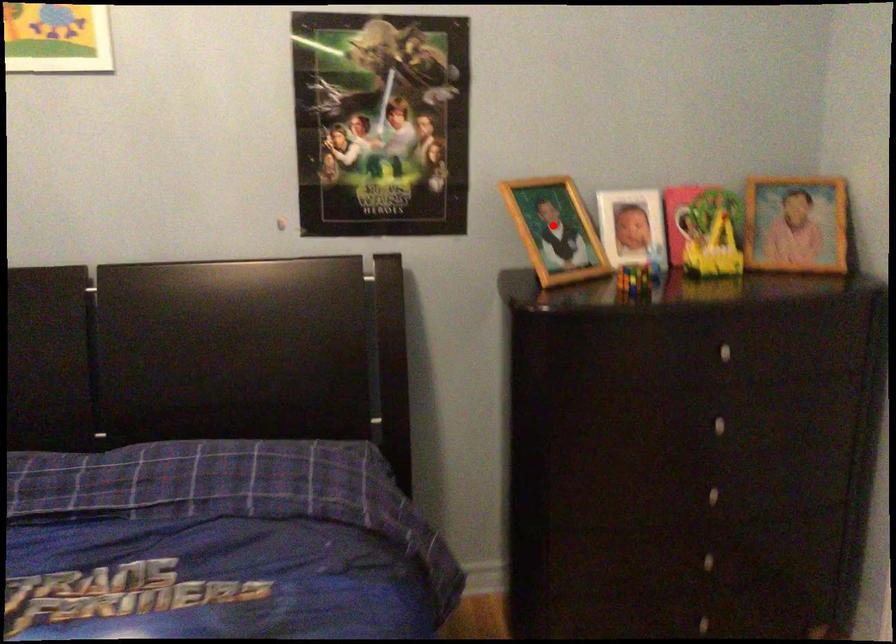
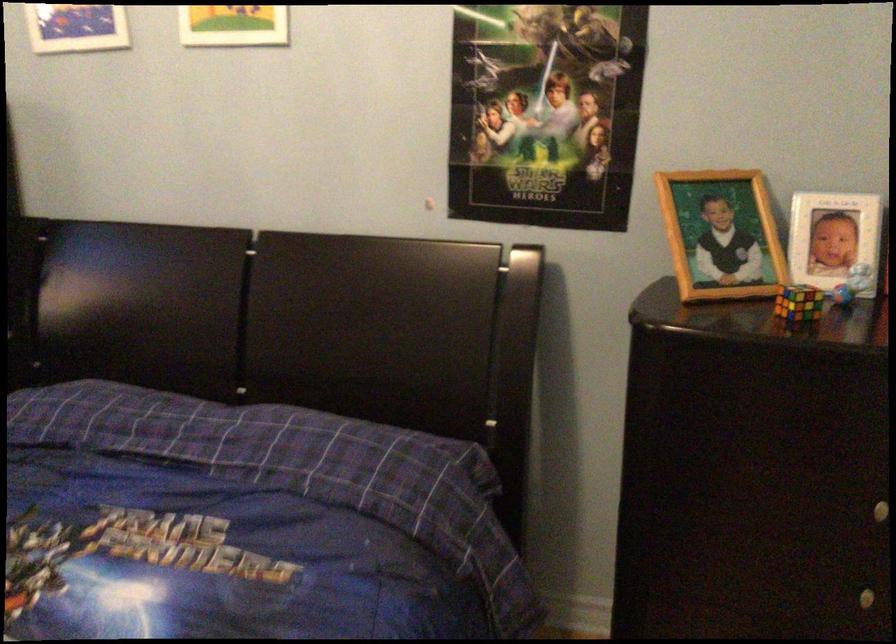
In the second image, find the point that corresponds to the highlighted location in the first image.

(720, 234)